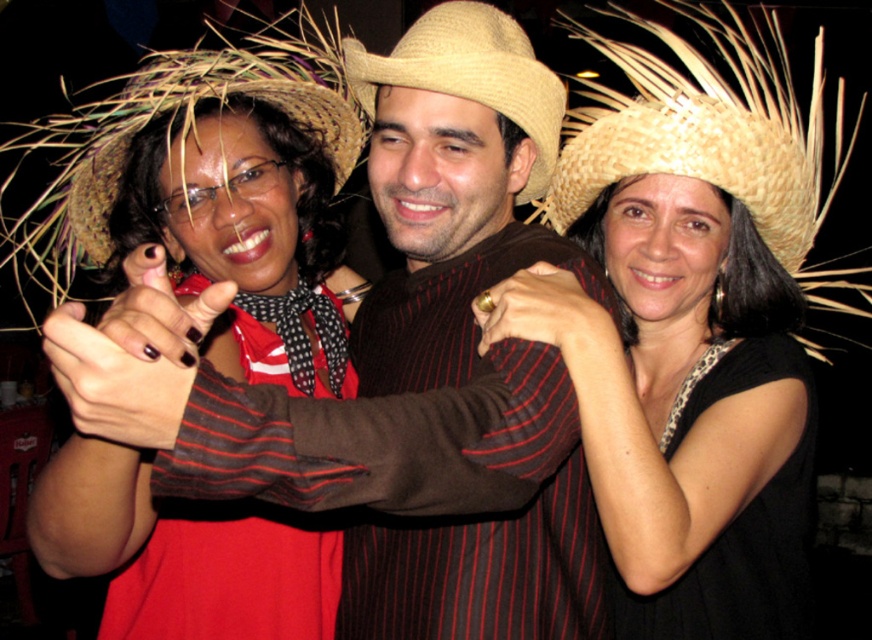
Which is more to the left, matte brown shirt at center or black matte dress at center?

matte brown shirt at center

Does matte brown shirt at center have a smaller size compared to black matte dress at center?

No.

Locate an element on the screen. matte brown shirt at center is located at coordinates (454, 188).

Who is taller, black knitted dress at right or straw hat at center?

With more height is black knitted dress at right.

Which is below, black knitted dress at right or straw hat at center?

black knitted dress at right is lower down.

Which is in front, point (663, 602) or point (412, 24)?

Point (412, 24)

Find the location of `black knitted dress at right`. black knitted dress at right is located at coordinates (736, 522).

From the picture: Does matte straw hat at upper left have a larger size compared to natural straw hat at upper right?

Actually, matte straw hat at upper left might be smaller than natural straw hat at upper right.

Between point (266, 321) and point (818, 221), which one is positioned behind?

The point (818, 221) is behind.

The width and height of the screenshot is (872, 640). What are the coordinates of `matte straw hat at upper left` in the screenshot? It's located at (244, 237).